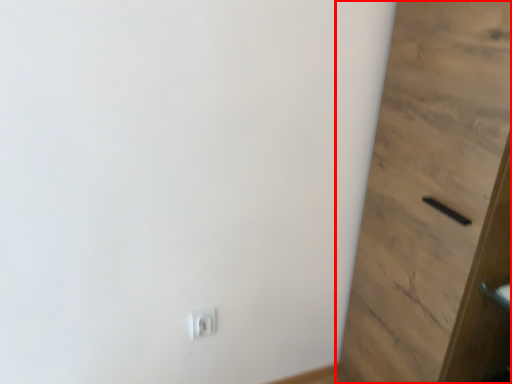
Question: From the image's perspective, where is door (annotated by the red box) located in relation to light switch in the image?

Choices:
 (A) above
 (B) below

Answer: (A)